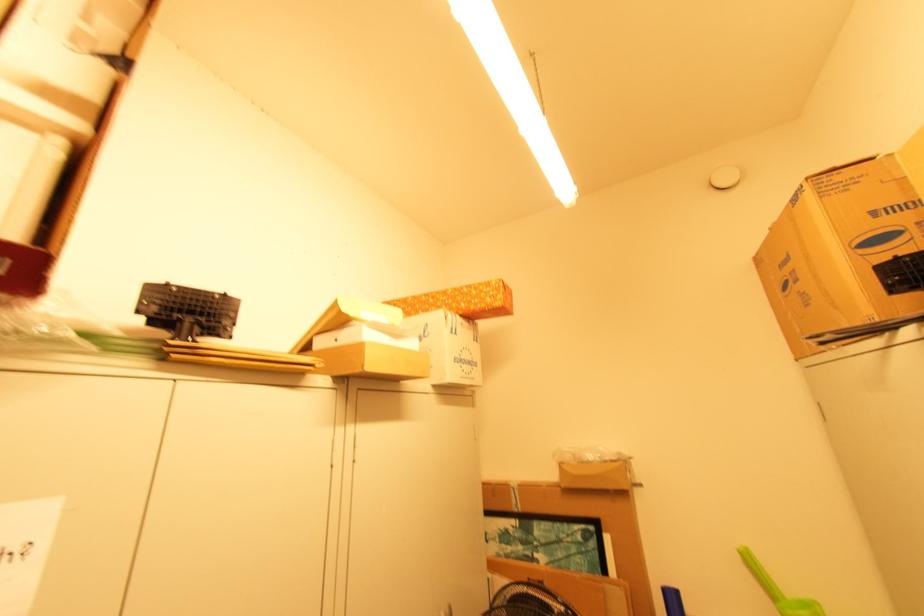
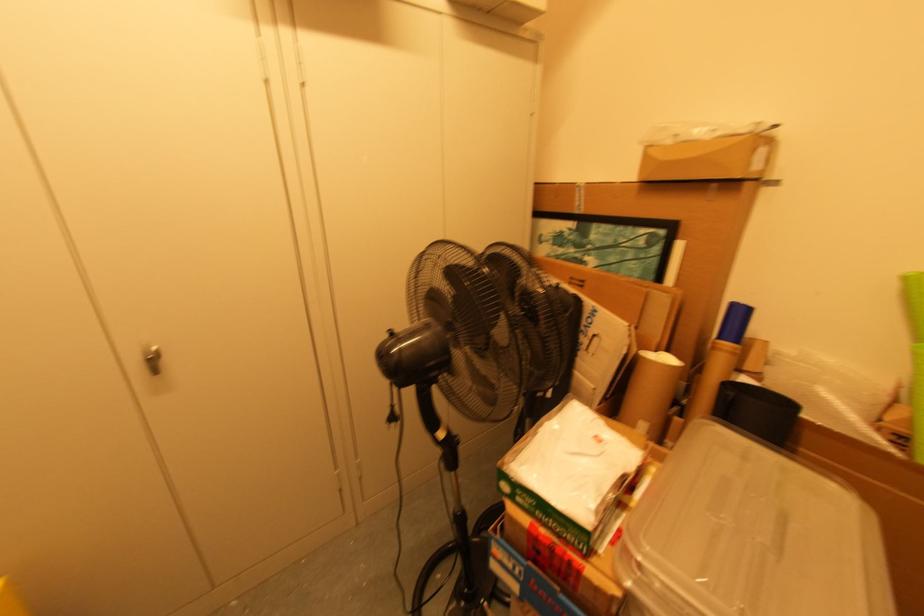
In the second image, find the point that corresponds to point (561, 525) in the first image.

(622, 228)